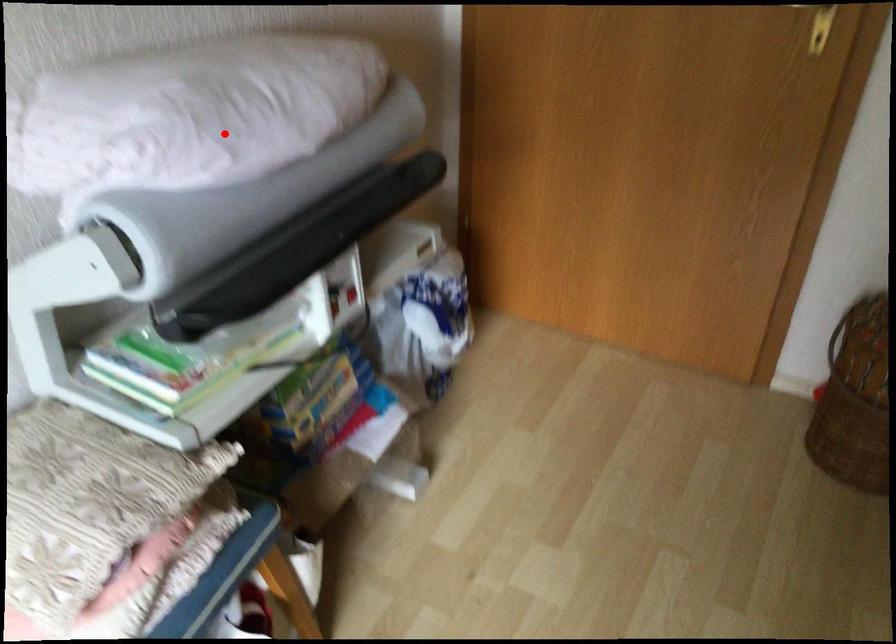
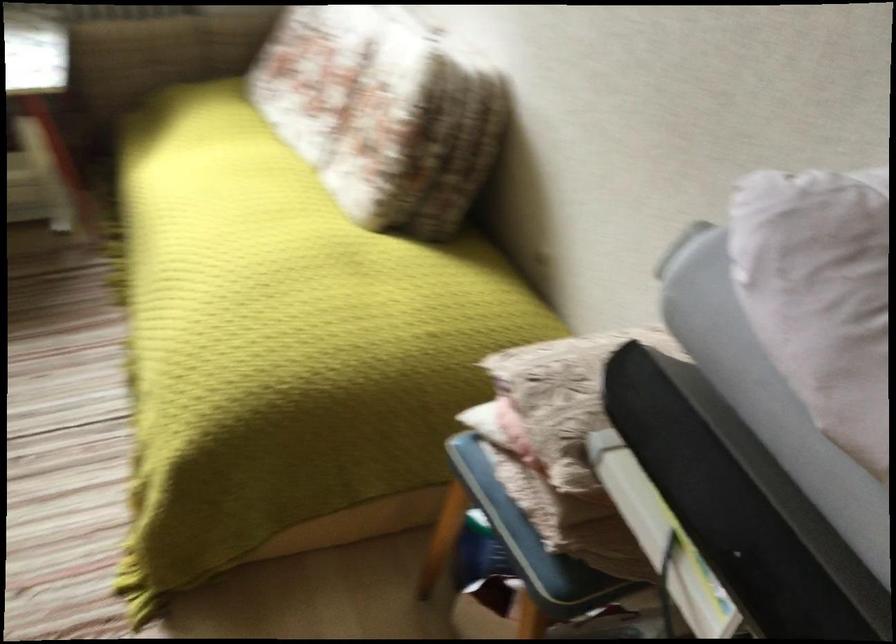
Locate, in the second image, the point that corresponds to the highlighted location in the first image.

(821, 295)